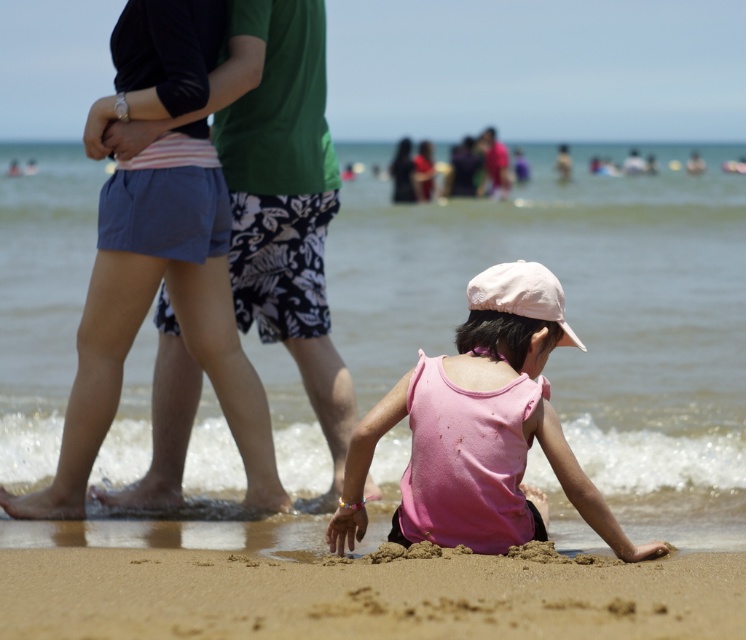
Looking at this image, who is positioned more to the left, clear water at lower center or matte blue shorts at left?

matte blue shorts at left

This screenshot has width=746, height=640. What do you see at coordinates (579, 316) in the screenshot? I see `clear water at lower center` at bounding box center [579, 316].

Locate an element on the screen. The image size is (746, 640). clear water at lower center is located at coordinates (579, 316).

At what (x,y) coordinates should I click in order to perform the action: click on clear water at lower center. Please return your answer as a coordinate pair (x, y). The width and height of the screenshot is (746, 640). Looking at the image, I should click on (579, 316).

Who is lower down, matte blue shorts at left or pink matte tank top at lower center?

pink matte tank top at lower center is lower down.

How much distance is there between matte blue shorts at left and pink matte tank top at lower center?

1.78 meters

Is point (213, 273) closer to viewer compared to point (513, 378)?

That is False.

Where is `matte blue shorts at left`? Image resolution: width=746 pixels, height=640 pixels. matte blue shorts at left is located at coordinates (137, 326).

Measure the distance between point (316, 634) and camera.

Point (316, 634) is 4.38 meters from camera.

The width and height of the screenshot is (746, 640). In order to click on fine-grained sand at lower center in this screenshot , I will do (x=363, y=595).

Who is more distant from viewer, (463, 598) or (521, 440)?

Positioned behind is point (521, 440).

Find the location of a particular element. Image resolution: width=746 pixels, height=640 pixels. fine-grained sand at lower center is located at coordinates (363, 595).